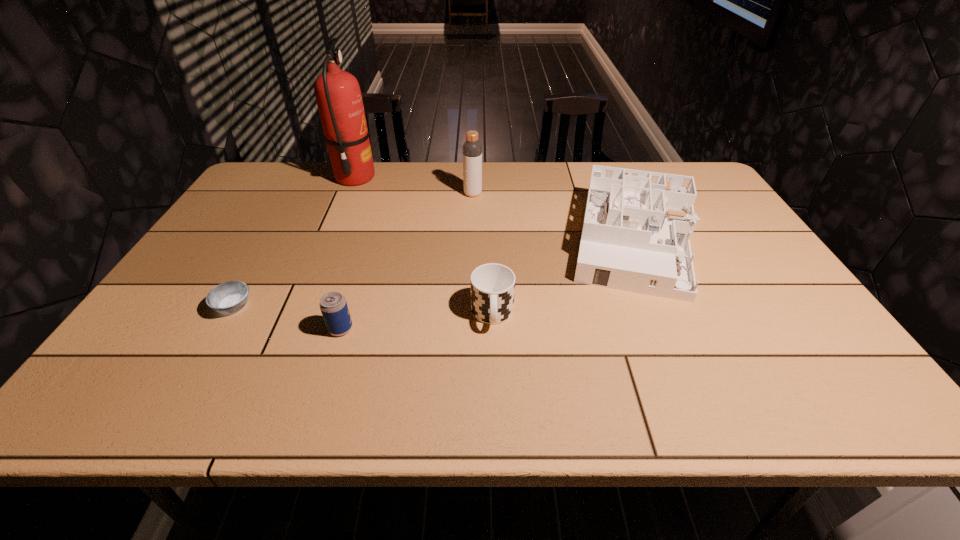
At what (x,y) coordinates should I click in order to perform the action: click on the tallest object. Please return your answer as a coordinate pair (x, y). Image resolution: width=960 pixels, height=540 pixels. Looking at the image, I should click on (338, 95).

I want to click on fire extinguisher, so click(x=338, y=95).

The height and width of the screenshot is (540, 960). Find the location of `bottle`. bottle is located at coordinates (472, 149).

At what (x,y) coordinates should I click in order to perform the action: click on the third tallest object. Please return your answer as a coordinate pair (x, y). Looking at the image, I should click on (637, 227).

You are a GUI agent. You are given a task and a screenshot of the screen. Output one action in this format:
    pyautogui.click(x=<x>, y=<y>)
    Task: Click on the rightmost object
    
    Given the screenshot: What is the action you would take?
    pyautogui.click(x=637, y=227)

You are a GUI agent. You are given a task and a screenshot of the screen. Output one action in this format:
    pyautogui.click(x=<x>, y=<y>)
    Task: Click on the cup
    This screenshot has width=960, height=540.
    Given the screenshot: What is the action you would take?
    pyautogui.click(x=492, y=285)

At what (x,y) coordinates should I click in order to perform the action: click on beer can. Please return your answer as a coordinate pair (x, y). The width and height of the screenshot is (960, 540). Looking at the image, I should click on (333, 305).

This screenshot has height=540, width=960. I want to click on the shortest object, so 229,297.

This screenshot has width=960, height=540. Identify the location of the leftmost object. (229, 297).

Locate an element on the screen. blank area located 0.310m on the side of the fire extinguisher with the nozzle and handle is located at coordinates (465, 178).